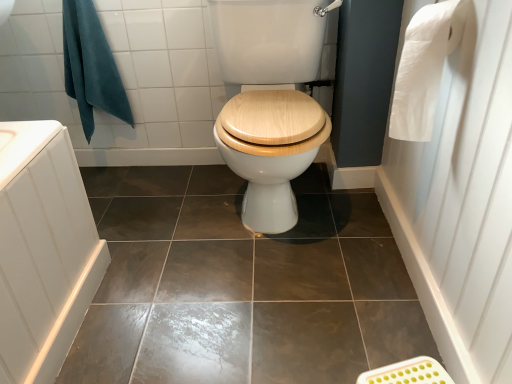
Question: From a real-world perspective, is brown glossy tile at center located higher than teal fabric towel at upper left?

Choices:
 (A) yes
 (B) no

Answer: (B)

Question: Considering the relative sizes of brown glossy tile at center and teal fabric towel at upper left in the image provided, is brown glossy tile at center bigger than teal fabric towel at upper left?

Choices:
 (A) no
 (B) yes

Answer: (B)

Question: Is brown glossy tile at center directly adjacent to teal fabric towel at upper left?

Choices:
 (A) no
 (B) yes

Answer: (A)

Question: From the image's perspective, is brown glossy tile at center beneath teal fabric towel at upper left?

Choices:
 (A) yes
 (B) no

Answer: (A)

Question: From a real-world perspective, is brown glossy tile at center positioned under teal fabric towel at upper left based on gravity?

Choices:
 (A) no
 (B) yes

Answer: (B)

Question: Can you confirm if brown glossy tile at center is wider than teal fabric towel at upper left?

Choices:
 (A) no
 (B) yes

Answer: (B)

Question: Can you confirm if white paper towel at right is positioned to the right of brown glossy tile at center?

Choices:
 (A) yes
 (B) no

Answer: (A)

Question: From the image's perspective, would you say white paper towel at right is positioned over brown glossy tile at center?

Choices:
 (A) no
 (B) yes

Answer: (B)

Question: From the image's perspective, is white paper towel at right under brown glossy tile at center?

Choices:
 (A) no
 (B) yes

Answer: (A)

Question: Is brown glossy tile at center located within white paper towel at right?

Choices:
 (A) no
 (B) yes

Answer: (A)

Question: Can you confirm if white paper towel at right is shorter than brown glossy tile at center?

Choices:
 (A) no
 (B) yes

Answer: (A)

Question: Is white paper towel at right not within brown glossy tile at center?

Choices:
 (A) no
 (B) yes

Answer: (B)

Question: Is teal fabric towel at upper left positioned behind brown glossy tile at center?

Choices:
 (A) no
 (B) yes

Answer: (B)